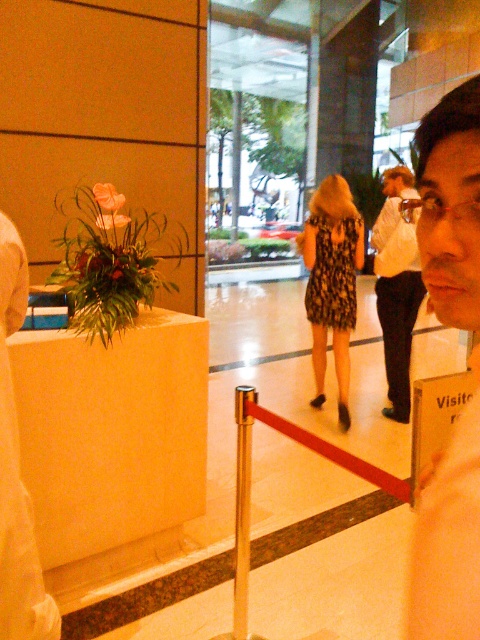
Is white shirt at center to the left of floral-patterned fabric dress at center from the viewer's perspective?

No, white shirt at center is not to the left of floral-patterned fabric dress at center.

Is point (393, 186) closer to viewer compared to point (344, 225)?

No, it is behind (344, 225).

Locate an element on the screen. white shirt at center is located at coordinates (396, 292).

From the picture: Who is lower down, matte black face at upper right or white shirt at center?

matte black face at upper right is below.

Does point (448, 520) come farther from viewer compared to point (408, 342)?

No, (448, 520) is closer to viewer.

What are the coordinates of `matte black face at upper right` in the screenshot? It's located at (448, 536).

From the picture: Between floral-patterned dress at center and white shirt at center, which one has more height?

white shirt at center is taller.

Is floral-patterned dress at center bigger than white shirt at center?

Yes, floral-patterned dress at center is bigger than white shirt at center.

Which is in front, point (358, 230) or point (402, 324)?

Point (358, 230) is more forward.

Image resolution: width=480 pixels, height=640 pixels. I want to click on floral-patterned dress at center, so click(332, 282).